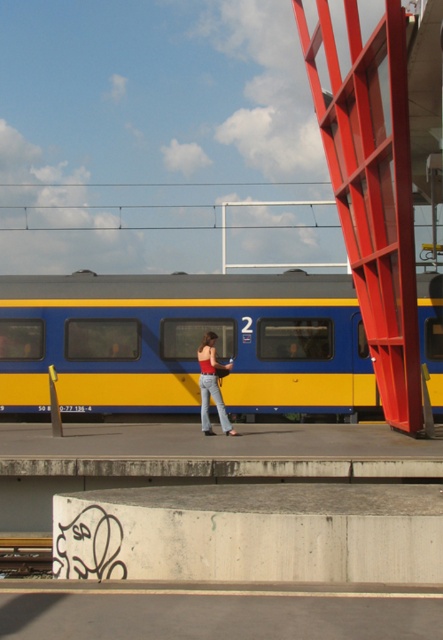
In the scene shown: Measure the distance from blue/yellow painted train at center to denim jeans at center.

blue/yellow painted train at center and denim jeans at center are 4.72 meters apart.

Does blue/yellow painted train at center have a larger size compared to denim jeans at center?

No.

Which is in front, point (163, 404) or point (214, 333)?

Point (214, 333) is more forward.

Locate an element on the screen. This screenshot has width=443, height=640. blue/yellow painted train at center is located at coordinates (182, 342).